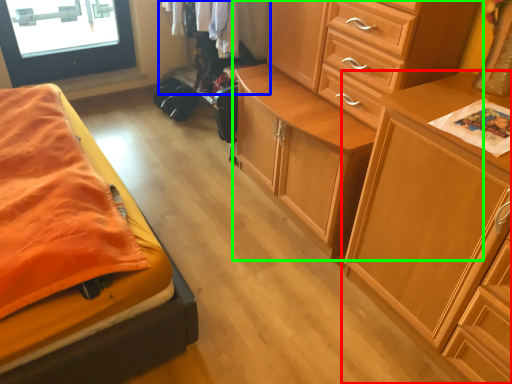
Question: Which object is positioned farthest from chest of drawers (highlighted by a red box)? Select from clothing (highlighted by a blue box) and chest of drawers (highlighted by a green box).

Choices:
 (A) clothing
 (B) chest of drawers

Answer: (A)